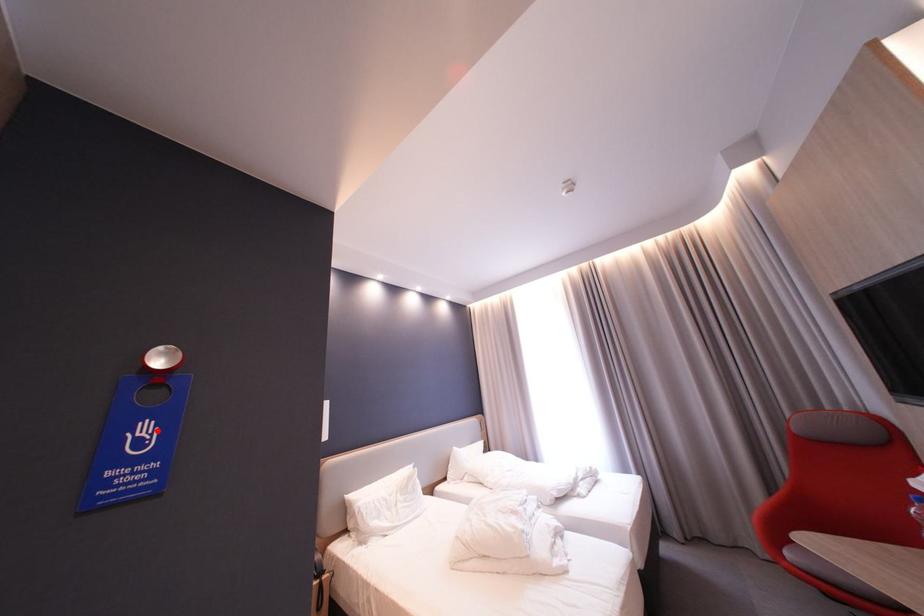
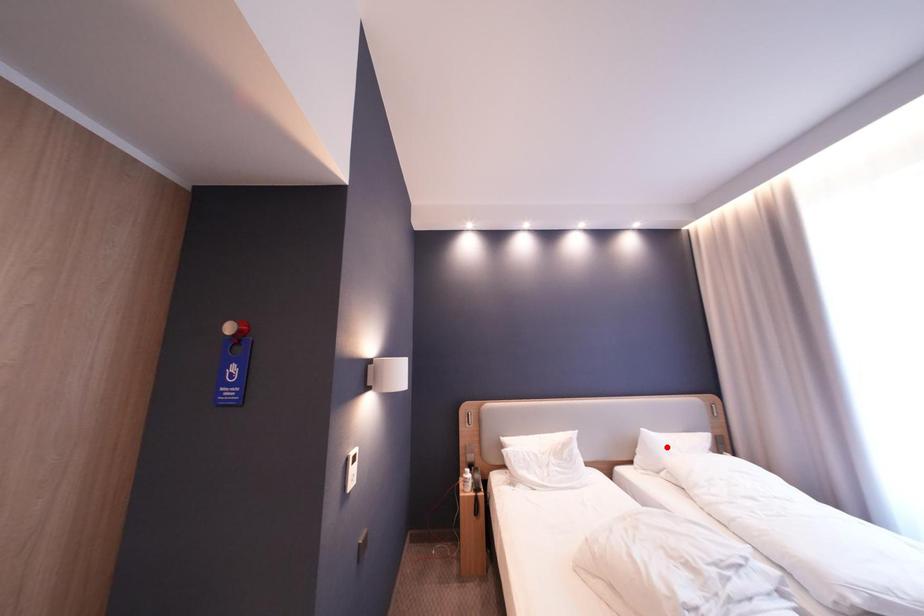
I am providing you with two images of the same scene from different viewpoints. A red point is marked on the first image and another point is marked on the second image. Is the marked point in image1 the same physical position as the marked point in image2?

No